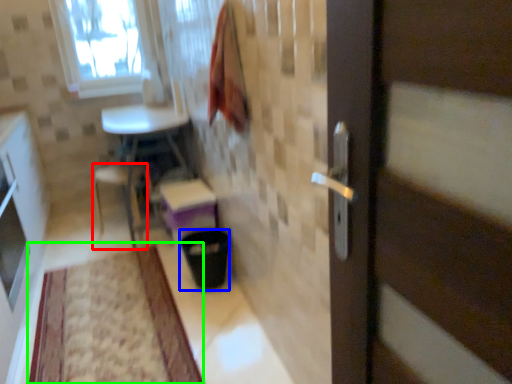
Question: Which is nearer to the chair (highlighted by a red box)? trash bin/can (highlighted by a blue box) or mat (highlighted by a green box).

Choices:
 (A) trash bin/can
 (B) mat

Answer: (A)